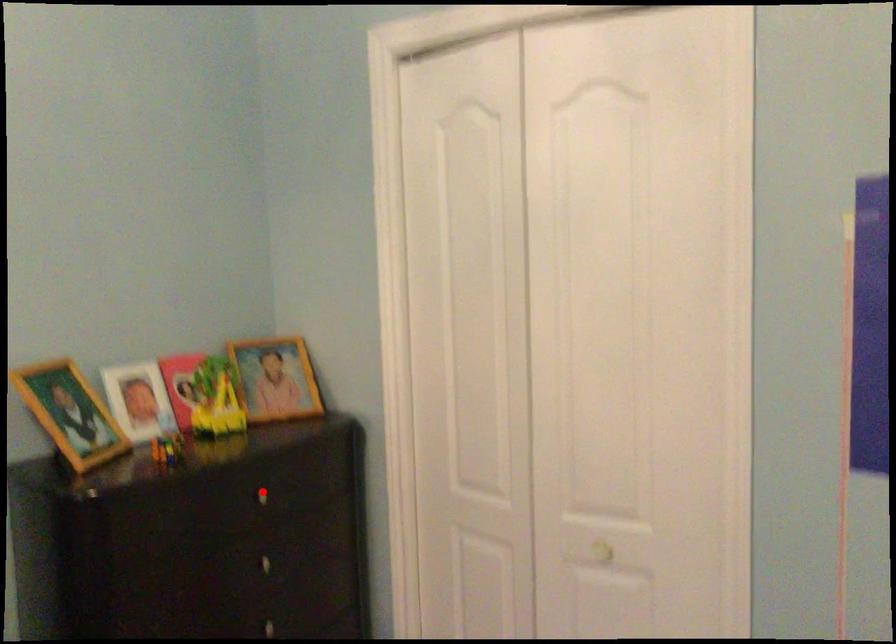
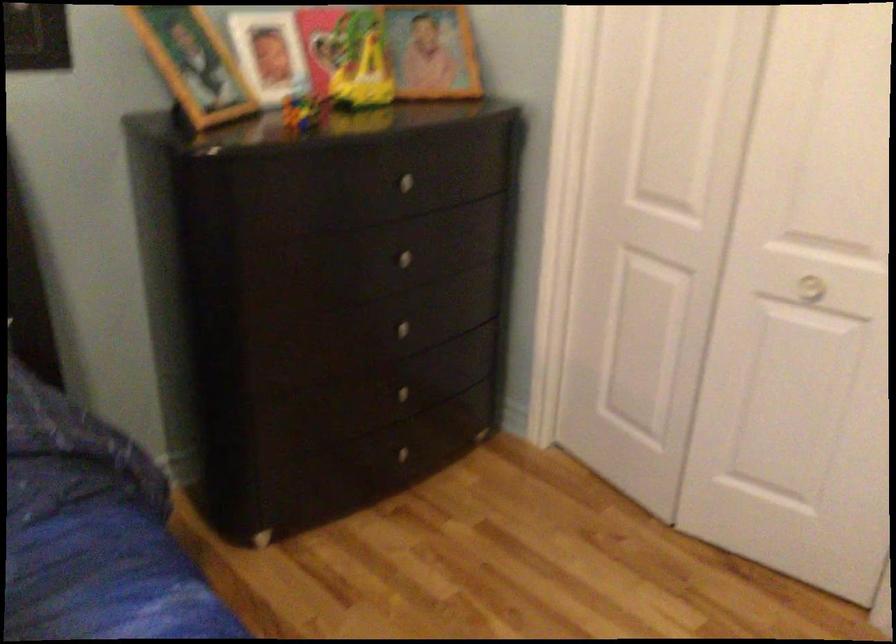
Question: I am providing you with two images of the same scene from different viewpoints. Image1 has a red point marked. In image2, the corresponding 3D location appears at what relative position? Reply with the corresponding letter.

Choices:
 (A) Closer
 (B) Farther

Answer: (A)